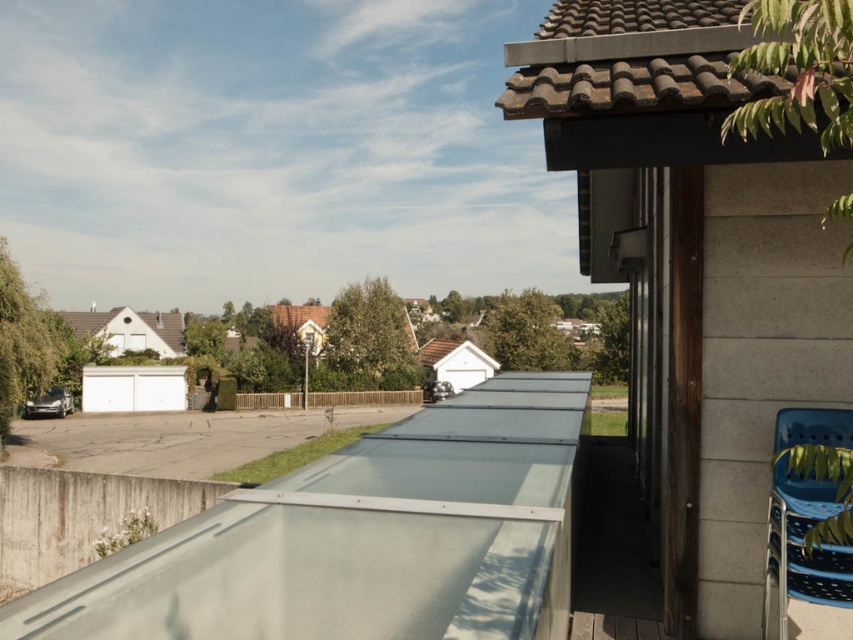
Is transparent glass balcony at lower center bigger than brown wooden fence at center?

Incorrect, transparent glass balcony at lower center is not larger than brown wooden fence at center.

Measure the distance between point (514,625) and camera.

Point (514,625) and camera are 6.60 feet apart from each other.

Describe the element at coordinates (361, 538) in the screenshot. I see `transparent glass balcony at lower center` at that location.

The height and width of the screenshot is (640, 853). What are the coordinates of `transparent glass balcony at lower center` in the screenshot? It's located at (361, 538).

Is transparent glass balcony at lower center taller than blue plastic chair at lower right?

No, transparent glass balcony at lower center is not taller than blue plastic chair at lower right.

In order to click on transparent glass balcony at lower center in this screenshot , I will do `click(361, 538)`.

You are a GUI agent. You are given a task and a screenshot of the screen. Output one action in this format:
    pyautogui.click(x=<x>, y=<y>)
    Task: Click on the transparent glass balcony at lower center
    
    Given the screenshot: What is the action you would take?
    pyautogui.click(x=361, y=538)

Find the location of `blue plastic chair at lower right`. blue plastic chair at lower right is located at coordinates (801, 545).

Can you confirm if blue plastic chair at lower right is taller than brown wooden fence at center?

Indeed, blue plastic chair at lower right has a greater height compared to brown wooden fence at center.

Find the location of `blue plastic chair at lower right`. blue plastic chair at lower right is located at coordinates (801, 545).